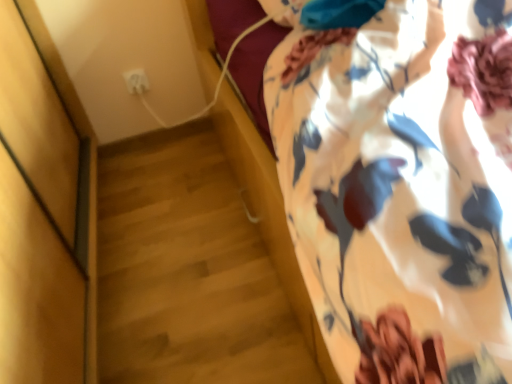
Question: From the image's perspective, is floral fabric curtain at upper right located above or below white plastic outlet at upper left?

Choices:
 (A) above
 (B) below

Answer: (B)

Question: From their relative heights in the image, would you say floral fabric curtain at upper right is taller or shorter than white plastic outlet at upper left?

Choices:
 (A) short
 (B) tall

Answer: (B)

Question: Based on their positions, is floral fabric curtain at upper right located to the left or right of white plastic outlet at upper left?

Choices:
 (A) right
 (B) left

Answer: (A)

Question: Based on their sizes in the image, would you say white plastic outlet at upper left is bigger or smaller than floral fabric curtain at upper right?

Choices:
 (A) small
 (B) big

Answer: (A)

Question: Considering the positions of white plastic outlet at upper left and floral fabric curtain at upper right in the image, is white plastic outlet at upper left taller or shorter than floral fabric curtain at upper right?

Choices:
 (A) tall
 (B) short

Answer: (B)

Question: Relative to floral fabric curtain at upper right, is white plastic outlet at upper left in front or behind?

Choices:
 (A) behind
 (B) front

Answer: (A)

Question: From the image's perspective, is white plastic outlet at upper left located above or below floral fabric curtain at upper right?

Choices:
 (A) above
 (B) below

Answer: (A)